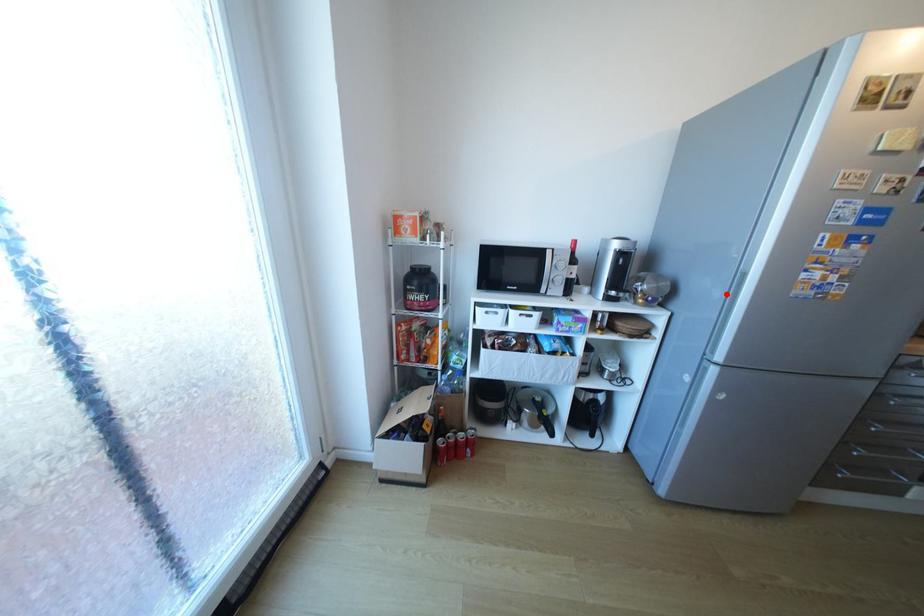
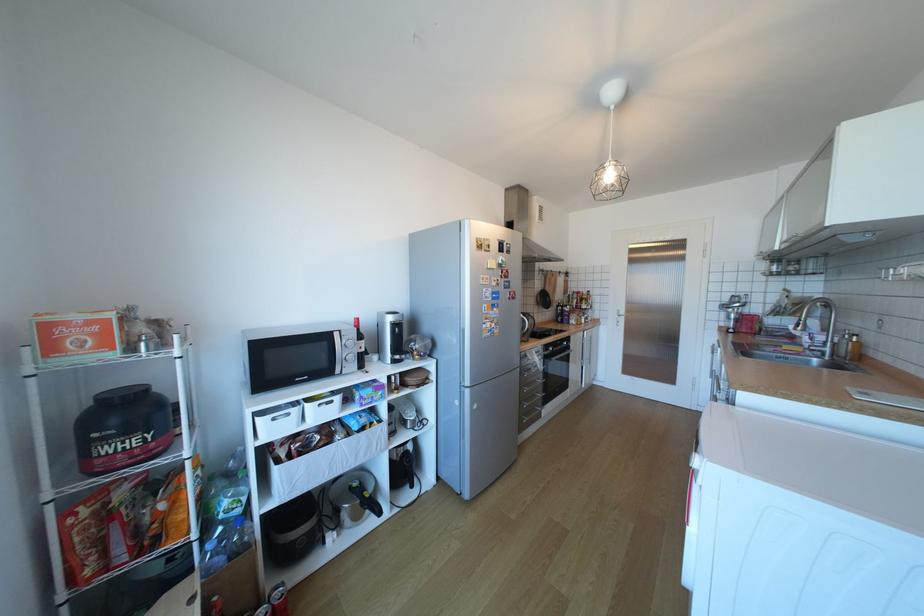
Where in the second image is the point corresponding to the highlighted location from the first image?

(465, 341)